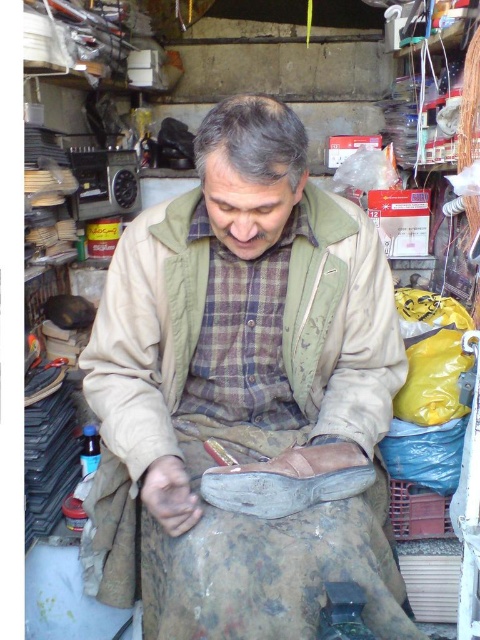
Does beige fabric jacket at center have a greater width compared to brown leather shoe at lower center?

Indeed, beige fabric jacket at center has a greater width compared to brown leather shoe at lower center.

Does beige fabric jacket at center appear on the right side of brown leather shoe at lower center?

Incorrect, beige fabric jacket at center is not on the right side of brown leather shoe at lower center.

Between point (168, 328) and point (213, 492), which one is positioned in front?

Point (213, 492) is in front.

In order to click on beige fabric jacket at center in this screenshot , I will do `click(145, 339)`.